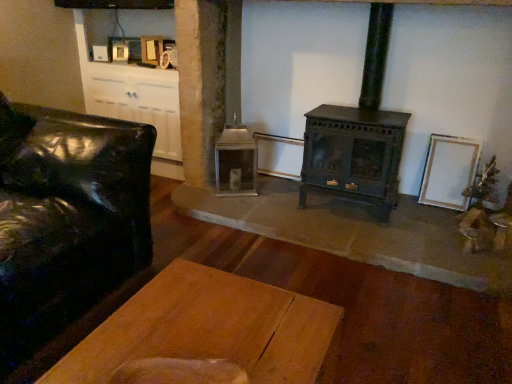
Question: Is wooden plank table at center directly adjacent to green matte wood burning stove at center?

Choices:
 (A) no
 (B) yes

Answer: (A)

Question: Considering the relative sizes of wooden plank table at center and green matte wood burning stove at center in the image provided, is wooden plank table at center smaller than green matte wood burning stove at center?

Choices:
 (A) yes
 (B) no

Answer: (A)

Question: Can you confirm if wooden plank table at center is thinner than green matte wood burning stove at center?

Choices:
 (A) yes
 (B) no

Answer: (B)

Question: Would you say wooden plank table at center is outside green matte wood burning stove at center?

Choices:
 (A) no
 (B) yes

Answer: (B)

Question: From the image's perspective, is wooden plank table at center located beneath green matte wood burning stove at center?

Choices:
 (A) yes
 (B) no

Answer: (A)

Question: Is point (166, 317) positioned closer to the camera than point (60, 253)?

Choices:
 (A) farther
 (B) closer

Answer: (B)

Question: Is wooden plank table at center taller or shorter than black leather couch at left?

Choices:
 (A) tall
 (B) short

Answer: (B)

Question: In the image, is wooden plank table at center positioned in front of or behind black leather couch at left?

Choices:
 (A) behind
 (B) front

Answer: (B)

Question: Looking at their shapes, would you say wooden plank table at center is wider or thinner than black leather couch at left?

Choices:
 (A) wide
 (B) thin

Answer: (B)

Question: Is black leather couch at left to the left or to the right of green matte wood burning stove at center in the image?

Choices:
 (A) right
 (B) left

Answer: (B)

Question: From a real-world perspective, is black leather couch at left positioned above or below green matte wood burning stove at center?

Choices:
 (A) above
 (B) below

Answer: (B)

Question: In terms of size, does black leather couch at left appear bigger or smaller than green matte wood burning stove at center?

Choices:
 (A) small
 (B) big

Answer: (B)

Question: Is black leather couch at left situated inside green matte wood burning stove at center or outside?

Choices:
 (A) inside
 (B) outside

Answer: (B)

Question: Is wooden plank table at center inside or outside of green matte wood burning stove at center?

Choices:
 (A) inside
 (B) outside

Answer: (B)

Question: From the image's perspective, is wooden plank table at center located above or below green matte wood burning stove at center?

Choices:
 (A) below
 (B) above

Answer: (A)